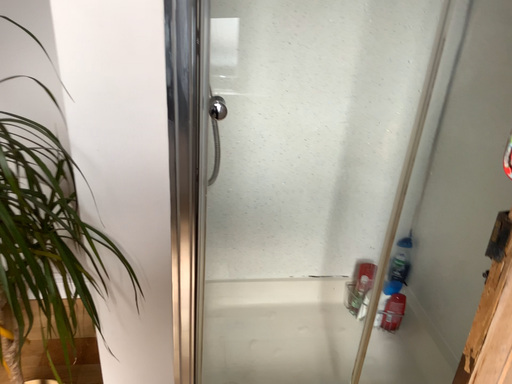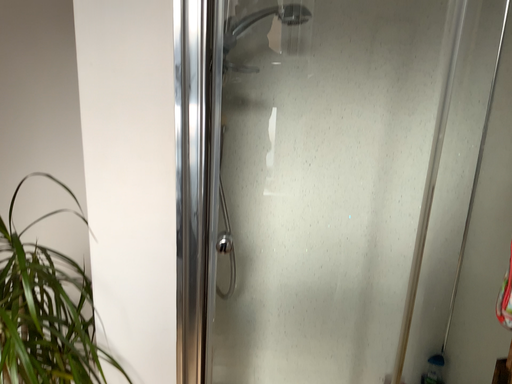
Question: How did the camera likely rotate when shooting the video?

Choices:
 (A) rotated left
 (B) rotated right

Answer: (A)